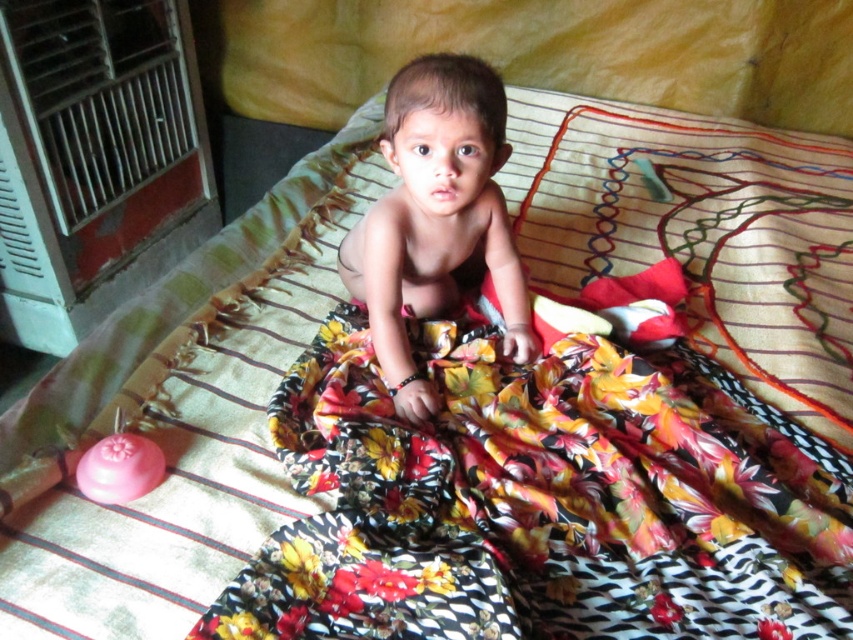
Question: Which object is closer to the camera taking this photo?

Choices:
 (A) smooth skin baby at center
 (B) floral fabric blanket at center

Answer: (B)

Question: Is floral fabric blanket at center wider than smooth skin baby at center?

Choices:
 (A) no
 (B) yes

Answer: (B)

Question: Which point appears farthest from the camera in this image?

Choices:
 (A) (416, 150)
 (B) (607, 433)

Answer: (B)

Question: Where is floral fabric blanket at center located in relation to smooth skin baby at center in the image?

Choices:
 (A) left
 (B) right

Answer: (B)

Question: Among these objects, which one is nearest to the camera?

Choices:
 (A) smooth skin baby at center
 (B) floral fabric blanket at center

Answer: (B)

Question: From the image, what is the correct spatial relationship of floral fabric blanket at center in relation to smooth skin baby at center?

Choices:
 (A) below
 (B) above

Answer: (A)